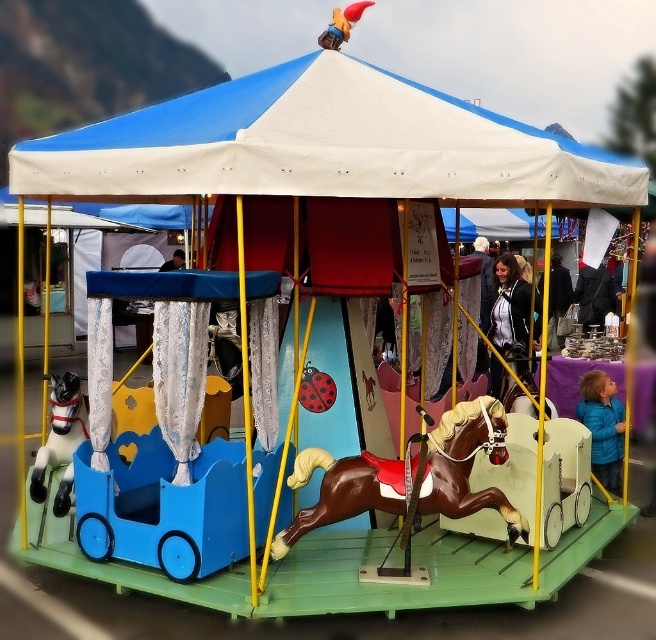
You are standing in front of the carousel and notice a blue matte jacket at lower right. If you want to reach it without moving your feet, can you touch it with a 6.2 meter long pole?

The blue matte jacket at lower right is 6.17 meters away from the viewer. Since the pole is 6.2 meters long, it is slightly longer than the distance, so you can just barely reach it with the pole.

You are a child trying to see the brown glossy horse at center from the ground. Is the white fabric canopy at upper center blocking your view of the horse?

Yes, the white fabric canopy at upper center is blocking your view of the brown glossy horse at center because it is positioned in front of it.